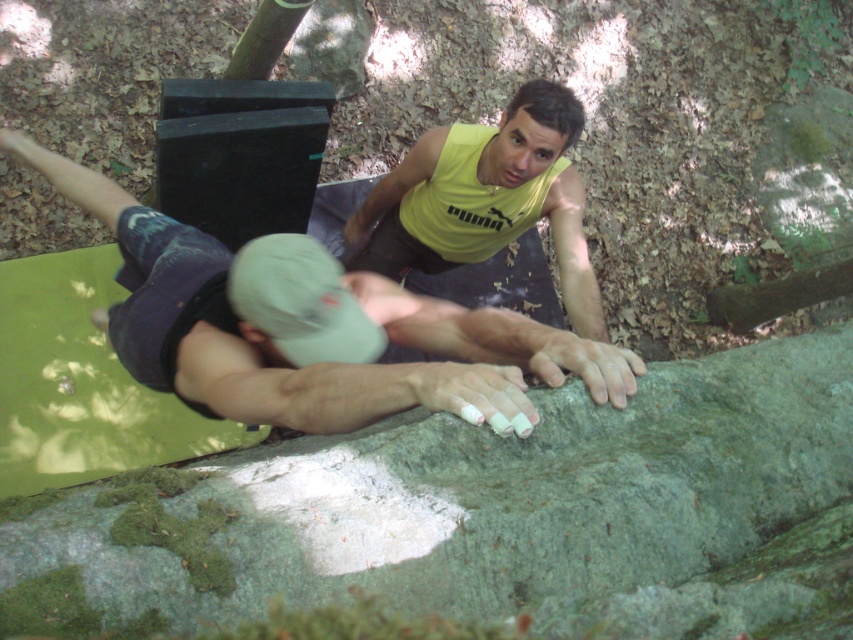
Question: Does matte gray climbing grip at center come in front of yellow matte tank top at upper center?

Choices:
 (A) yes
 (B) no

Answer: (A)

Question: Which object is closer to the camera taking this photo?

Choices:
 (A) matte gray climbing grip at center
 (B) yellow matte tank top at upper center

Answer: (A)

Question: Which of the following is the farthest from the observer?

Choices:
 (A) yellow matte tank top at upper center
 (B) matte gray climbing grip at center

Answer: (A)

Question: Can you confirm if matte gray climbing grip at center is positioned above yellow matte tank top at upper center?

Choices:
 (A) yes
 (B) no

Answer: (B)

Question: Does matte gray climbing grip at center have a greater width compared to yellow matte tank top at upper center?

Choices:
 (A) no
 (B) yes

Answer: (B)